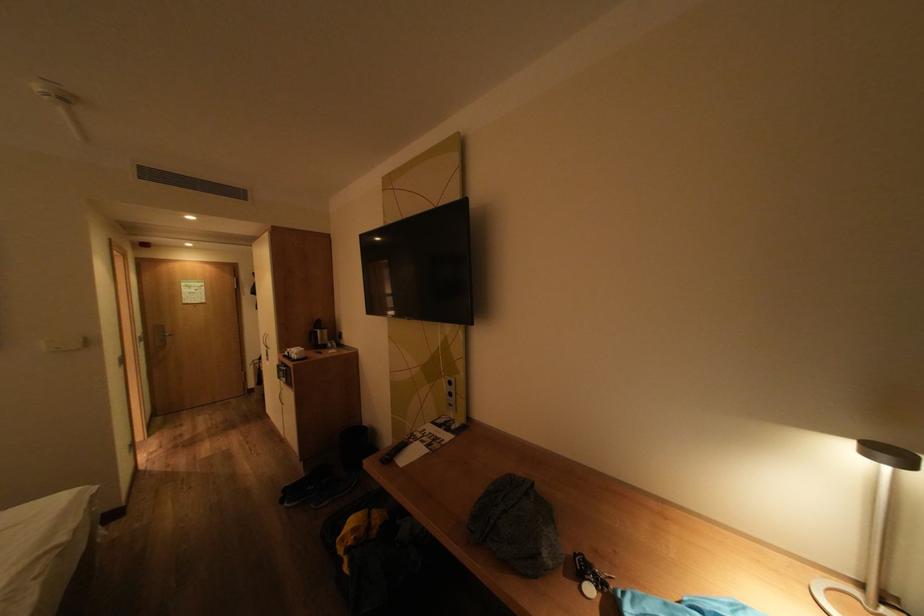
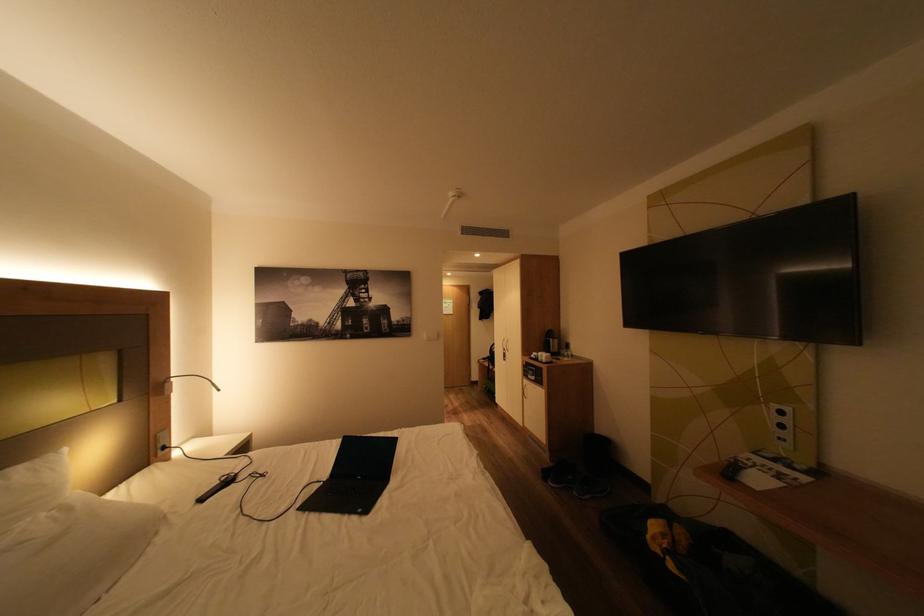
Find the pixel in the second image that matches the point at 359,544 in the first image.

(675, 546)